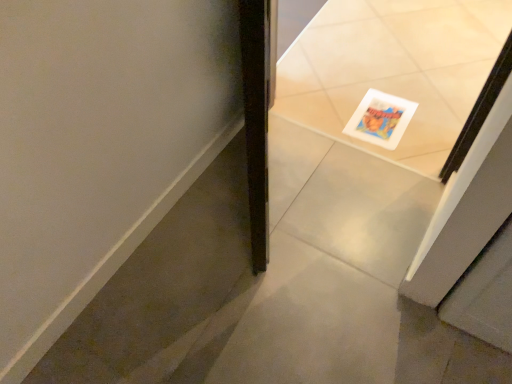
Where is `white matte door at lower left`? The height and width of the screenshot is (384, 512). white matte door at lower left is located at coordinates (99, 144).

What is the approximate width of white matte door at lower left?

The width of white matte door at lower left is 2.25 centimeters.

This screenshot has height=384, width=512. Describe the element at coordinates (99, 144) in the screenshot. I see `white matte door at lower left` at that location.

Image resolution: width=512 pixels, height=384 pixels. I want to click on white matte door at lower left, so click(99, 144).